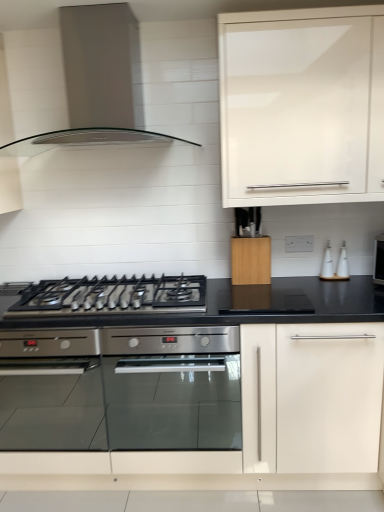
Where is `white glossy cabinet at upper right, marked as the first cabinetry in a top-to-bottom arrangement`? The width and height of the screenshot is (384, 512). white glossy cabinet at upper right, marked as the first cabinetry in a top-to-bottom arrangement is located at coordinates (302, 106).

Describe the element at coordinates (112, 295) in the screenshot. Image resolution: width=384 pixels, height=512 pixels. I see `black matte gas stove at center` at that location.

You are a GUI agent. You are given a task and a screenshot of the screen. Output one action in this format:
    pyautogui.click(x=<x>, y=<y>)
    Task: Click on the white glossy bottle at right
    Image resolution: width=384 pixels, height=512 pixels.
    Given the screenshot: What is the action you would take?
    pyautogui.click(x=327, y=264)

Locate an element on the screen. This screenshot has width=384, height=512. white glossy cabinet at upper right, the second cabinetry from the bottom is located at coordinates (302, 106).

From a real-world perspective, is stainless steel oven at center positioned above or below white glossy cabinet at upper right, marked as the first cabinetry in a top-to-bottom arrangement?

stainless steel oven at center is situated lower than white glossy cabinet at upper right, marked as the first cabinetry in a top-to-bottom arrangement, in the real world.

Is stainless steel oven at center positioned far away from white glossy cabinet at upper right, the second cabinetry from the bottom?

Absolutely, stainless steel oven at center is distant from white glossy cabinet at upper right, the second cabinetry from the bottom.

Which object is further away from the camera taking this photo, stainless steel oven at center or white glossy cabinet at upper right, marked as the first cabinetry in a top-to-bottom arrangement?

stainless steel oven at center is behind.

What are the coordinates of `oven lying below the white glossy cabinet at upper right, the second cabinetry from the bottom (from the image's perspective)` in the screenshot? It's located at (172, 388).

Locate an element on the screen. The width and height of the screenshot is (384, 512). cabinetry behind the stainless steel oven at center is located at coordinates (251, 260).

Does point (181, 382) come in front of point (270, 255)?

No, it is not.

Is stainless steel oven at center in front of or behind wooden knife block at center, which is the second cabinetry in top-to-bottom order, in the image?

In the image, stainless steel oven at center appears in front of wooden knife block at center, which is the second cabinetry in top-to-bottom order.

Does stainless steel oven at center have a lesser height compared to wooden knife block at center, placed as the 1th cabinetry when sorted from bottom to top?

Incorrect, the height of stainless steel oven at center does not fall short of that of wooden knife block at center, placed as the 1th cabinetry when sorted from bottom to top.

In the image, there is a white glossy soap dispenser at right. Where is `gas stove below it (from a real-world perspective)`? The image size is (384, 512). gas stove below it (from a real-world perspective) is located at coordinates (112, 295).

Which is more to the right, black matte gas stove at center or white glossy soap dispenser at right?

white glossy soap dispenser at right.

Which of these two, black matte gas stove at center or white glossy soap dispenser at right, is smaller?

white glossy soap dispenser at right is smaller.

Is white glossy soap dispenser at right positioned with its back to satin metallic range hood at upper center?

No, white glossy soap dispenser at right is not facing away from satin metallic range hood at upper center.

From a real-world perspective, relative to satin metallic range hood at upper center, is white glossy soap dispenser at right vertically above or below?

From a real-world perspective, white glossy soap dispenser at right is physically below satin metallic range hood at upper center.

This screenshot has height=512, width=384. In order to click on home appliance that is above the white glossy soap dispenser at right (from a real-world perspective) in this screenshot , I will do `click(98, 81)`.

Which object is positioned more to the left, white glossy soap dispenser at right or satin metallic range hood at upper center?

satin metallic range hood at upper center.

In the scene shown: Is white glossy soap dispenser at right shorter than wooden knife block at center, placed as the 1th cabinetry when sorted from bottom to top?

Yes, white glossy soap dispenser at right is shorter than wooden knife block at center, placed as the 1th cabinetry when sorted from bottom to top.

Identify the location of kitchen appliance below the wooden knife block at center, placed as the 1th cabinetry when sorted from bottom to top (from a real-world perspective). (342, 263).

Considering the sizes of objects white glossy soap dispenser at right and wooden knife block at center, which is the second cabinetry in top-to-bottom order, in the image provided, who is wider, white glossy soap dispenser at right or wooden knife block at center, which is the second cabinetry in top-to-bottom order,?

wooden knife block at center, which is the second cabinetry in top-to-bottom order, is wider.

Considering the positions of objects white glossy soap dispenser at right and wooden knife block at center, which is the second cabinetry in top-to-bottom order, in the image provided, who is more to the left, white glossy soap dispenser at right or wooden knife block at center, which is the second cabinetry in top-to-bottom order,?

wooden knife block at center, which is the second cabinetry in top-to-bottom order, is more to the left.

Is the depth of black matte gas stove at center less than that of wooden knife block at center, placed as the 1th cabinetry when sorted from bottom to top?

Yes.

Considering the relative sizes of black matte gas stove at center and wooden knife block at center, which is the second cabinetry in top-to-bottom order, in the image provided, is black matte gas stove at center smaller than wooden knife block at center, which is the second cabinetry in top-to-bottom order,?

No.

Can you tell me how much white glossy cabinet at upper right, marked as the first cabinetry in a top-to-bottom arrangement, and satin metallic range hood at upper center differ in facing direction?

The facing directions of white glossy cabinet at upper right, marked as the first cabinetry in a top-to-bottom arrangement, and satin metallic range hood at upper center are 0.546 degrees apart.

Is white glossy cabinet at upper right, the second cabinetry from the bottom, positioned with its back to satin metallic range hood at upper center?

No, satin metallic range hood at upper center is not at the back of white glossy cabinet at upper right, the second cabinetry from the bottom.

Considering the relative sizes of white glossy cabinet at upper right, marked as the first cabinetry in a top-to-bottom arrangement, and satin metallic range hood at upper center in the image provided, is white glossy cabinet at upper right, marked as the first cabinetry in a top-to-bottom arrangement, smaller than satin metallic range hood at upper center?

Yes.

You are a GUI agent. You are given a task and a screenshot of the screen. Output one action in this format:
    pyautogui.click(x=<x>, y=<y>)
    Task: Click on the cabinetry in front of the stainless steel oven at center
    The image size is (384, 512).
    Given the screenshot: What is the action you would take?
    pyautogui.click(x=302, y=106)

What are the coordinates of `cabinetry that is the 1st object above the stainless steel oven at center (from a real-world perspective)` in the screenshot? It's located at (251, 260).

Consider the image. When comparing their distances from black matte gas stove at center, does wooden knife block at center, which is the second cabinetry in top-to-bottom order, or stainless steel oven at center seem further?

Based on the image, stainless steel oven at center appears to be further to black matte gas stove at center.

Which object lies further to the anchor point satin metallic range hood at upper center, white glossy soap dispenser at right or white glossy cabinet at upper right, marked as the first cabinetry in a top-to-bottom arrangement?

The object further to satin metallic range hood at upper center is white glossy soap dispenser at right.

In the scene shown: When comparing their distances from white glossy soap dispenser at right, does white glossy bottle at right or white glossy cabinet at upper right, the second cabinetry from the bottom, seem further?

white glossy cabinet at upper right, the second cabinetry from the bottom, is positioned further to the anchor white glossy soap dispenser at right.

Looking at the image, which one is located further to white glossy soap dispenser at right, white glossy bottle at right or black matte gas stove at center?

The object further to white glossy soap dispenser at right is black matte gas stove at center.

Which object lies further to the anchor point black matte gas stove at center, wooden knife block at center, which is the second cabinetry in top-to-bottom order, or white glossy bottle at right?

Among the two, white glossy bottle at right is located further to black matte gas stove at center.

From the image, which object appears to be nearer to wooden knife block at center, placed as the 1th cabinetry when sorted from bottom to top, satin metallic range hood at upper center or stainless steel oven at center?

The object closer to wooden knife block at center, placed as the 1th cabinetry when sorted from bottom to top, is satin metallic range hood at upper center.

Estimate the real-world distances between objects in this image. Which object is further from wooden knife block at center, placed as the 1th cabinetry when sorted from bottom to top, white glossy soap dispenser at right or white glossy cabinet at upper right, marked as the first cabinetry in a top-to-bottom arrangement?

white glossy cabinet at upper right, marked as the first cabinetry in a top-to-bottom arrangement, is further to wooden knife block at center, placed as the 1th cabinetry when sorted from bottom to top.

Looking at the image, which one is located closer to white glossy soap dispenser at right, wooden knife block at center, placed as the 1th cabinetry when sorted from bottom to top, or satin metallic range hood at upper center?

Among the two, wooden knife block at center, placed as the 1th cabinetry when sorted from bottom to top, is located nearer to white glossy soap dispenser at right.

You are a GUI agent. You are given a task and a screenshot of the screen. Output one action in this format:
    pyautogui.click(x=<x>, y=<y>)
    Task: Click on the cabinetry between white glossy cabinet at upper right, marked as the first cabinetry in a top-to-bottom arrangement, and white glossy soap dispenser at right in the up-down direction
    Image resolution: width=384 pixels, height=512 pixels.
    Given the screenshot: What is the action you would take?
    pyautogui.click(x=251, y=260)

I want to click on oven situated between black matte gas stove at center and white glossy bottle at right from left to right, so pos(172,388).

At what (x,y) coordinates should I click in order to perform the action: click on cabinetry located between satin metallic range hood at upper center and white glossy cabinet at upper right, marked as the first cabinetry in a top-to-bottom arrangement, in the left-right direction. Please return your answer as a coordinate pair (x, y). This screenshot has height=512, width=384. Looking at the image, I should click on (251, 260).

Where is `appliance between satin metallic range hood at upper center and white glossy soap dispenser at right`? The image size is (384, 512). appliance between satin metallic range hood at upper center and white glossy soap dispenser at right is located at coordinates (327, 264).